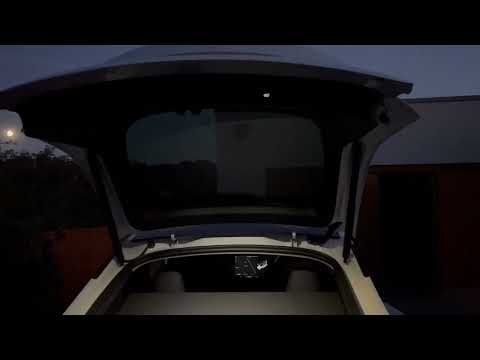
You are a GUI agent. You are given a task and a screenshot of the screen. Output one action in this format:
    pyautogui.click(x=<x>, y=<y>)
    Task: Click on the right seat
    The width and height of the screenshot is (480, 360).
    Given the screenshot: What is the action you would take?
    pyautogui.click(x=295, y=284)